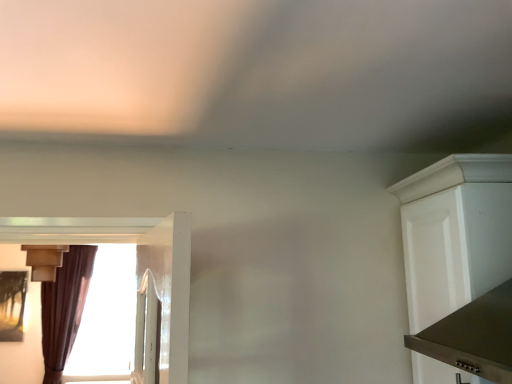
Question: Is matte beige light fixture at left smaller than brown velvet curtain at left?

Choices:
 (A) no
 (B) yes

Answer: (B)

Question: From a real-world perspective, does matte beige light fixture at left sit lower than brown velvet curtain at left?

Choices:
 (A) yes
 (B) no

Answer: (B)

Question: Is matte beige light fixture at left with brown velvet curtain at left?

Choices:
 (A) yes
 (B) no

Answer: (B)

Question: Is there a large distance between matte beige light fixture at left and brown velvet curtain at left?

Choices:
 (A) no
 (B) yes

Answer: (A)

Question: Is the depth of matte beige light fixture at left greater than that of brown velvet curtain at left?

Choices:
 (A) no
 (B) yes

Answer: (A)

Question: Is matte beige light fixture at left facing away from brown velvet curtain at left?

Choices:
 (A) no
 (B) yes

Answer: (B)

Question: Can brown velvet curtain at left be found inside white matte cabinet at right?

Choices:
 (A) no
 (B) yes

Answer: (A)

Question: Is white matte cabinet at right in contact with brown velvet curtain at left?

Choices:
 (A) no
 (B) yes

Answer: (A)

Question: Does white matte cabinet at right have a smaller size compared to brown velvet curtain at left?

Choices:
 (A) no
 (B) yes

Answer: (B)

Question: Is white matte cabinet at right oriented towards brown velvet curtain at left?

Choices:
 (A) yes
 (B) no

Answer: (B)

Question: From a real-world perspective, is white matte cabinet at right positioned under brown velvet curtain at left based on gravity?

Choices:
 (A) no
 (B) yes

Answer: (A)

Question: Is white matte cabinet at right positioned beyond the bounds of brown velvet curtain at left?

Choices:
 (A) yes
 (B) no

Answer: (A)

Question: Is the depth of brown velvet curtain at left less than that of matte beige light fixture at left?

Choices:
 (A) no
 (B) yes

Answer: (A)